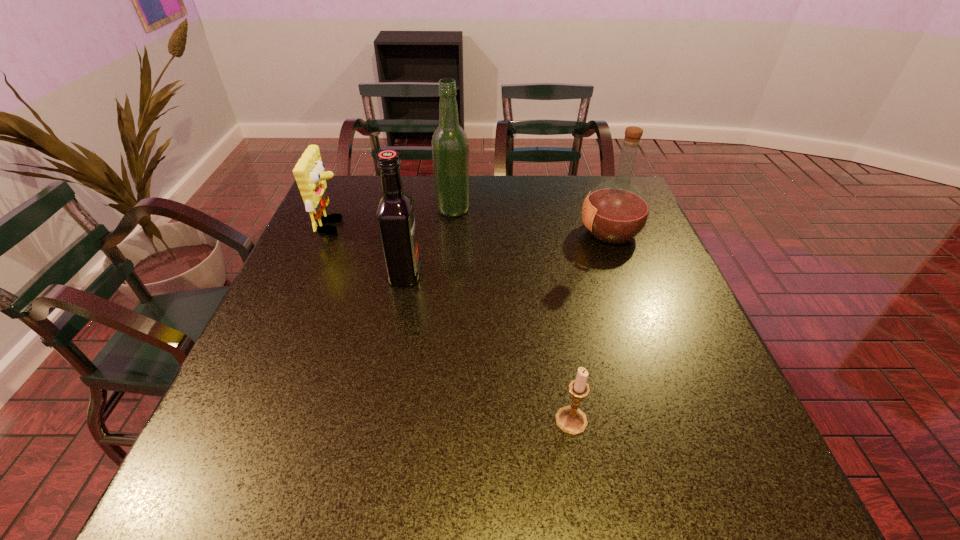
Choose which liquor is the nearest neighbor to the nearest liquor. Please provide its 2D coordinates. Your answer should be formatted as a tuple, i.e. [(x, y)], where the tuple contains the x and y coordinates of a point satisfying the conditions above.

[(450, 148)]

Locate an element on the screen. The width and height of the screenshot is (960, 540). vacant space that satisfies the following two spatial constraints: 1. on the face of the leftmost object; 2. on the right side of the second object from right to left is located at coordinates (251, 421).

Locate an element on the screen. The height and width of the screenshot is (540, 960). vacant space that satisfies the following two spatial constraints: 1. on the back side of the candle holder; 2. on the face of the fourth tallest object is located at coordinates click(x=539, y=226).

The height and width of the screenshot is (540, 960). Find the location of `free spot that satisfies the following two spatial constraints: 1. on the face of the leftmost object; 2. on the right side of the fourth object from left to right`. free spot that satisfies the following two spatial constraints: 1. on the face of the leftmost object; 2. on the right side of the fourth object from left to right is located at coordinates coord(251,421).